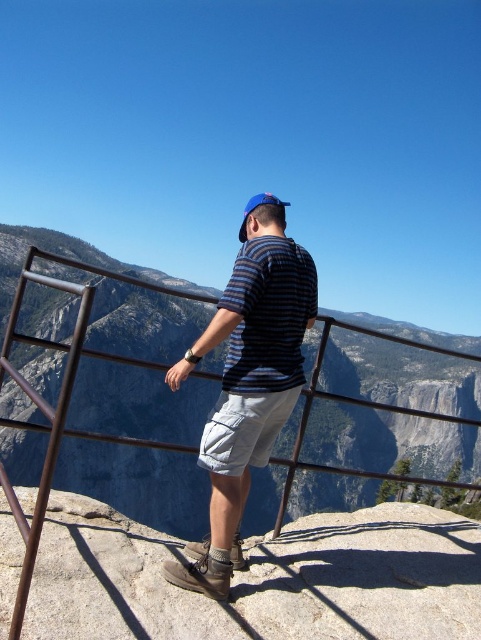
Does gray rock formation at center have a lesser width compared to gray/rough rock at center?

No, gray rock formation at center is not thinner than gray/rough rock at center.

Can you confirm if gray rock formation at center is bigger than gray/rough rock at center?

Yes.

Who is more distant from viewer, (349, 376) or (304, 586)?

The point (349, 376) is more distant.

Image resolution: width=481 pixels, height=640 pixels. I want to click on gray rock formation at center, so point(113,380).

Who is shorter, striped fabric shirt at center or blue fabric baseball cap at upper center?

With less height is striped fabric shirt at center.

From the picture: Is striped fabric shirt at center in front of blue fabric baseball cap at upper center?

Yes, it is in front of blue fabric baseball cap at upper center.

Does point (266, 307) come closer to viewer compared to point (261, 198)?

Yes, point (266, 307) is closer to viewer.

The height and width of the screenshot is (640, 481). In order to click on striped fabric shirt at center in this screenshot , I will do `click(248, 385)`.

The height and width of the screenshot is (640, 481). In order to click on gray/rough rock at center in this screenshot , I will do `click(262, 579)`.

Is gray/rough rock at center shorter than striped fabric shirt at center?

Indeed, gray/rough rock at center has a lesser height compared to striped fabric shirt at center.

Is point (173, 547) closer to viewer compared to point (299, 292)?

That is True.

Locate an element on the screen. The height and width of the screenshot is (640, 481). gray/rough rock at center is located at coordinates (262, 579).